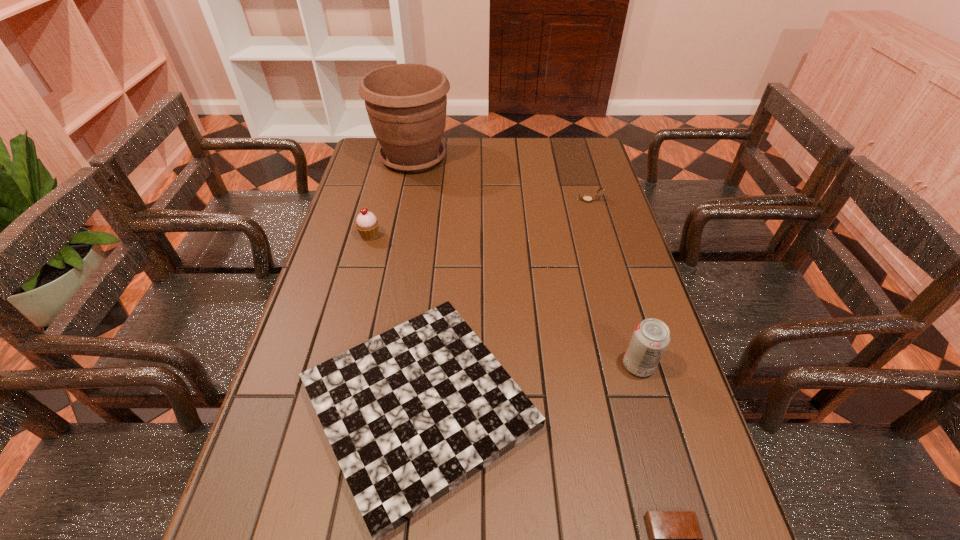
The image size is (960, 540). What are the coordinates of `the tallest object` in the screenshot? It's located at tap(406, 103).

Locate an element on the screen. The image size is (960, 540). flowerpot is located at coordinates (406, 103).

This screenshot has height=540, width=960. I want to click on the fifth shortest object, so click(x=651, y=337).

You are a GUI agent. You are given a task and a screenshot of the screen. Output one action in this format:
    pyautogui.click(x=<x>, y=<y>)
    Task: Click on the fourth shortest object
    The width and height of the screenshot is (960, 540).
    Given the screenshot: What is the action you would take?
    pyautogui.click(x=367, y=224)

Image resolution: width=960 pixels, height=540 pixels. Find the location of `cupcake`. cupcake is located at coordinates (367, 224).

Where is `the second farthest object`? the second farthest object is located at coordinates (586, 198).

Identify the location of compass. (586, 198).

Locate an element on the screen. The width and height of the screenshot is (960, 540). vacant region located 0.280m on the front of the farthest object is located at coordinates (398, 233).

The width and height of the screenshot is (960, 540). What are the coordinates of `vacant area situated on the back of the soda can` in the screenshot? It's located at (607, 256).

In order to click on vacant space located on the front of the fourth shortest object in this screenshot , I will do (348, 320).